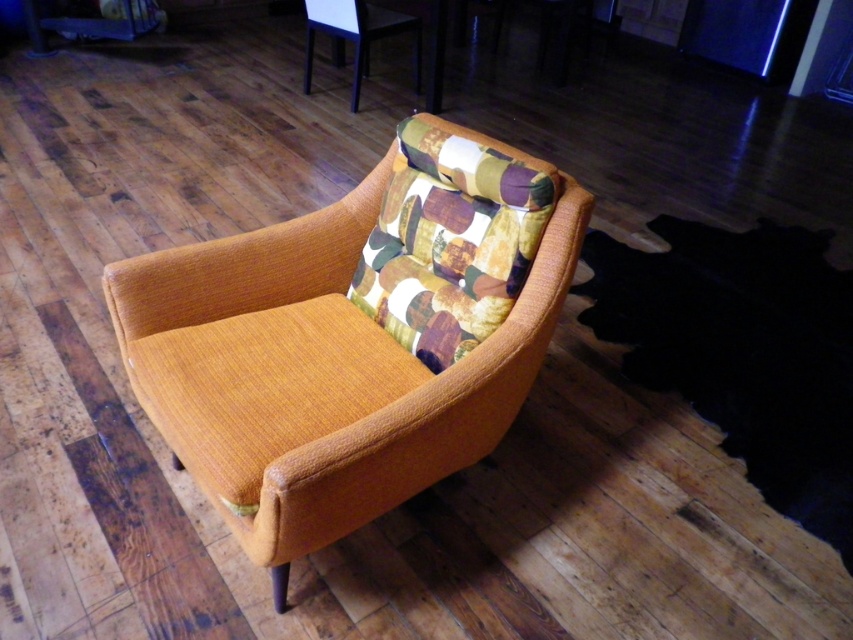
Does mustard fabric armchair at center have a greater height compared to textured fabric chair at upper center?

Indeed, mustard fabric armchair at center has a greater height compared to textured fabric chair at upper center.

Can you confirm if mustard fabric armchair at center is smaller than textured fabric chair at upper center?

No.

Is point (186, 433) closer to camera compared to point (326, 28)?

Yes, it is in front of point (326, 28).

At what (x,y) coordinates should I click in order to perform the action: click on mustard fabric armchair at center. Please return your answer as a coordinate pair (x, y). Looking at the image, I should click on (352, 337).